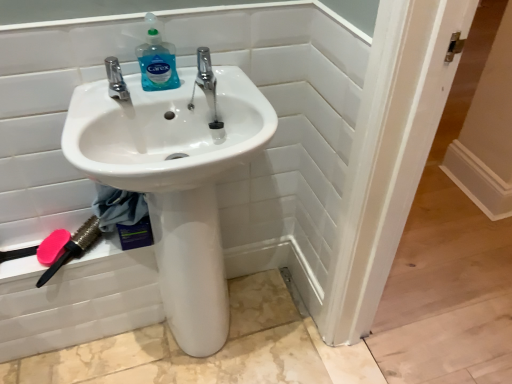
Question: Is polished chrome tap at center, the 1th tap positioned from the right, spatially inside translucent plastic bottle at upper center, or outside of it?

Choices:
 (A) outside
 (B) inside

Answer: (A)

Question: From the image's perspective, is polished chrome tap at center, the 1th tap positioned from the right, above or below translucent plastic bottle at upper center?

Choices:
 (A) below
 (B) above

Answer: (A)

Question: Which of these objects is positioned farthest from the translucent plastic bottle at upper center?

Choices:
 (A) polished chrome tap at upper left, which is the 2th tap from right to left
 (B) pink plastic brush at lower left
 (C) white glossy sink at center
 (D) polished chrome tap at center, which ranks as the 2th tap in left-to-right order
 (E) white glossy sink at center

Answer: (B)

Question: Which of these objects is positioned closest to the polished chrome tap at upper left, positioned as the 1th tap in left-to-right order?

Choices:
 (A) pink matte brush at lower left
 (B) translucent plastic bottle at upper center
 (C) white glossy sink at center
 (D) polished chrome tap at center, the 1th tap positioned from the right
 (E) pink plastic brush at lower left

Answer: (B)